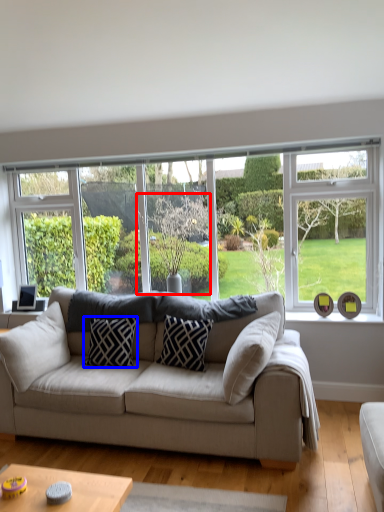
Question: Which point is further to the camera, tree (highlighted by a red box) or pillow (highlighted by a blue box)?

Choices:
 (A) tree
 (B) pillow

Answer: (A)